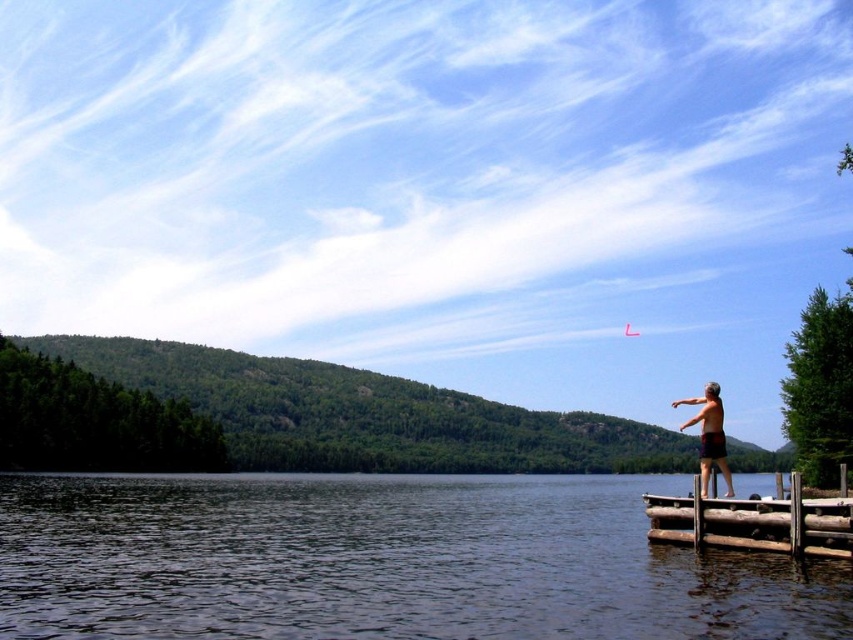
You are standing at the lakeside and want to locate two specific points in the image. The first point is at coordinates point (805, 548) and the second is at point (714, 401). Which point is closer to you, the observer?

Point (805, 548) is in front of point (714, 401), so it is closer to you.

You are standing at the point labeled as point (753, 522) in the image. What object are you currently standing on?

The point (753, 522) indicates the brown wooden dock at lower right, so you are standing on the brown wooden dock at lower right.

You are standing on the brown wooden dock at lower right and want to walk to the skinny man at right. Which direction should you move in?

The brown wooden dock at lower right is positioned on the left side of the skinny man at right, so you should move to the right to reach him.